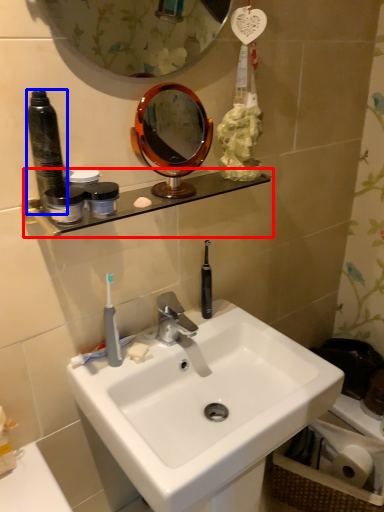
Question: Which object appears farthest to the camera in this image, shelve (highlighted by a red box) or bottle (highlighted by a blue box)?

Choices:
 (A) shelve
 (B) bottle

Answer: (A)